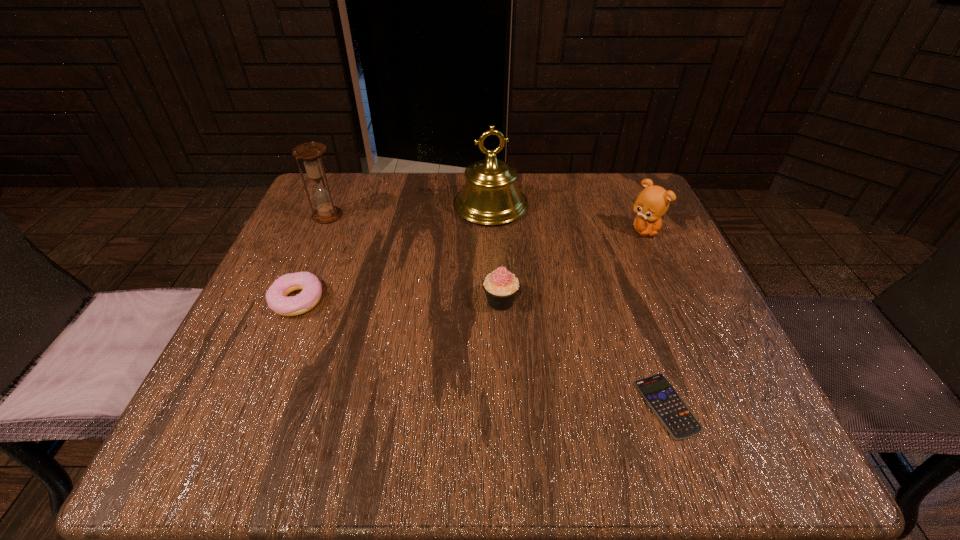
Locate an element on the screen. The width and height of the screenshot is (960, 540). bell is located at coordinates (490, 196).

Image resolution: width=960 pixels, height=540 pixels. Identify the location of hourglass. (310, 153).

Identify the location of the fourth shortest object. This screenshot has height=540, width=960. (652, 203).

At what (x,y) coordinates should I click in order to perform the action: click on the rightmost object. Please return your answer as a coordinate pair (x, y). The image size is (960, 540). Looking at the image, I should click on (652, 203).

Locate an element on the screen. cupcake is located at coordinates (501, 286).

You are a GUI agent. You are given a task and a screenshot of the screen. Output one action in this format:
    pyautogui.click(x=<x>, y=<y>)
    Task: Click on the doughnut
    
    Given the screenshot: What is the action you would take?
    pyautogui.click(x=276, y=296)

Find the location of a particular element. The image size is (960, 540). the fifth object from left to right is located at coordinates (674, 414).

Image resolution: width=960 pixels, height=540 pixels. In order to click on calculator in this screenshot , I will do `click(674, 414)`.

Find the location of a particular element. vacant space situated 0.250m on the left of the bell is located at coordinates (348, 206).

Image resolution: width=960 pixels, height=540 pixels. Identify the location of free space located 0.400m on the front of the second tallest object. (258, 375).